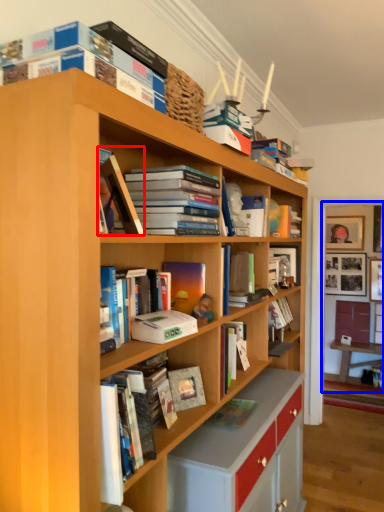
Question: Which of the following is the closest to the observer, book (highlighted by a red box) or bookstore (highlighted by a blue box)?

Choices:
 (A) book
 (B) bookstore

Answer: (A)